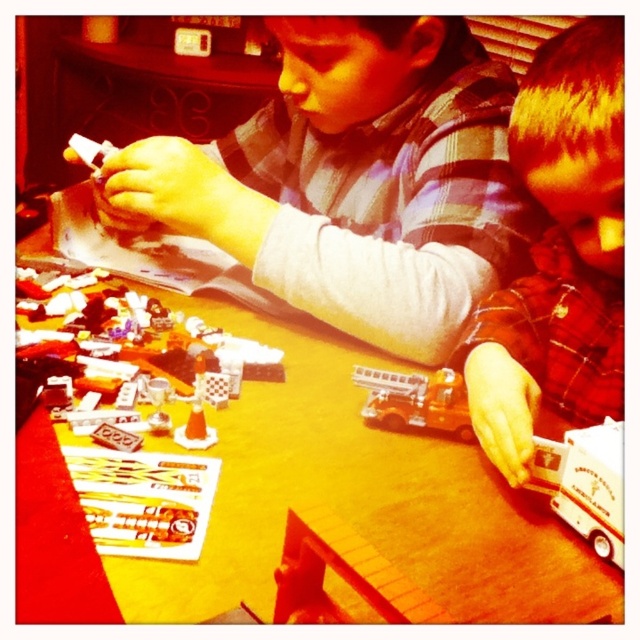
Question: Does matte plastic toy car at lower right appear over white plastic ambulance at lower right?

Choices:
 (A) yes
 (B) no

Answer: (A)

Question: Does yellow matte table at center lie behind matte plastic toy car at lower right?

Choices:
 (A) yes
 (B) no

Answer: (B)

Question: Which point appears closest to the camera in this image?

Choices:
 (A) (429, 380)
 (B) (38, 548)
 (C) (620, 246)
 (D) (595, 428)

Answer: (B)

Question: Which point appears farthest from the camera in this image?

Choices:
 (A) (403, 376)
 (B) (541, 609)
 (C) (579, 179)

Answer: (A)

Question: Is matte black toy car at center to the left of matte plastic toy car at lower right from the viewer's perspective?

Choices:
 (A) no
 (B) yes

Answer: (B)

Question: Which object appears farthest from the camera in this image?

Choices:
 (A) white plastic ambulance at lower right
 (B) metallic silver firetruck at center
 (C) matte plastic toy car at lower right

Answer: (B)